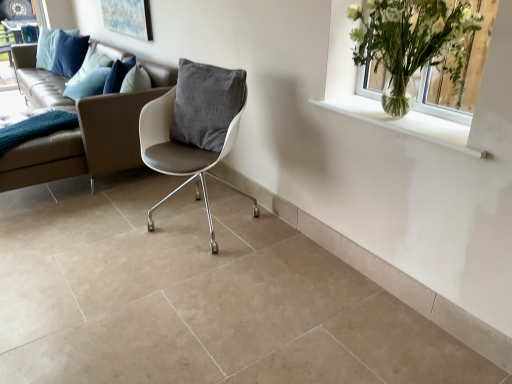
Question: Is clear glass vase at upper right at the right side of white leather chair at center?

Choices:
 (A) yes
 (B) no

Answer: (A)

Question: From the image's perspective, is clear glass vase at upper right beneath white leather chair at center?

Choices:
 (A) no
 (B) yes

Answer: (A)

Question: Is clear glass vase at upper right completely or partially outside of white leather chair at center?

Choices:
 (A) yes
 (B) no

Answer: (A)

Question: From a real-world perspective, is clear glass vase at upper right positioned under white leather chair at center based on gravity?

Choices:
 (A) no
 (B) yes

Answer: (A)

Question: From the image's perspective, does clear glass vase at upper right appear higher than white leather chair at center?

Choices:
 (A) yes
 (B) no

Answer: (A)

Question: Is clear glass vase at upper right far from white leather chair at center?

Choices:
 (A) no
 (B) yes

Answer: (A)

Question: Does clear glass vase at upper right have a larger size compared to matte glass window frame at upper left?

Choices:
 (A) no
 (B) yes

Answer: (B)

Question: Is clear glass vase at upper right positioned far away from matte glass window frame at upper left?

Choices:
 (A) no
 (B) yes

Answer: (B)

Question: Could you tell me if clear glass vase at upper right is facing matte glass window frame at upper left?

Choices:
 (A) yes
 (B) no

Answer: (B)

Question: Is clear glass vase at upper right outside matte glass window frame at upper left?

Choices:
 (A) yes
 (B) no

Answer: (A)

Question: Is clear glass vase at upper right oriented away from matte glass window frame at upper left?

Choices:
 (A) yes
 (B) no

Answer: (B)

Question: Considering the relative sizes of clear glass vase at upper right and matte glass window frame at upper left in the image provided, is clear glass vase at upper right smaller than matte glass window frame at upper left?

Choices:
 (A) no
 (B) yes

Answer: (A)

Question: Is matte glass window frame at upper left at the right side of white leather chair at center?

Choices:
 (A) no
 (B) yes

Answer: (A)